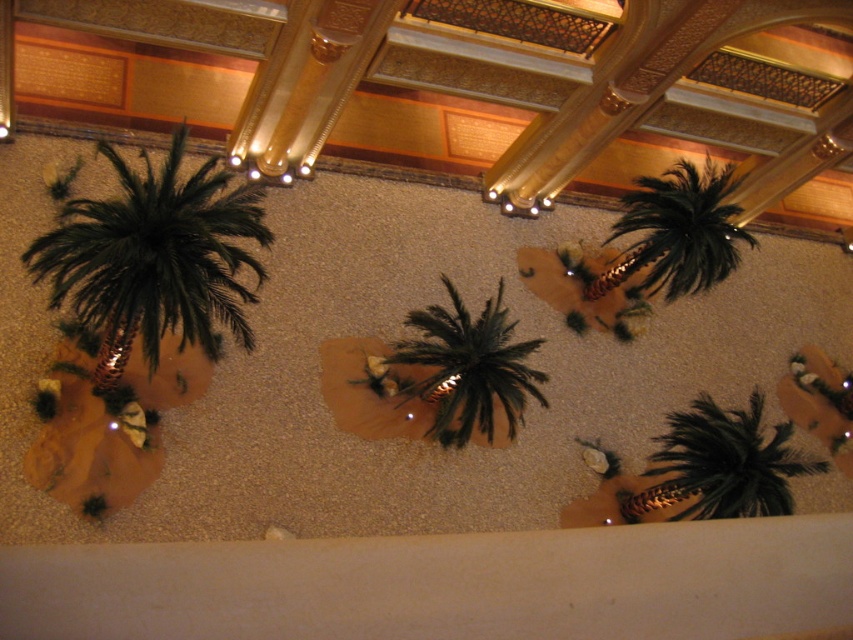
Can you confirm if green artificial palm tree at left is bigger than black feathered palm tree at upper right?

Yes.

Identify the location of green artificial palm tree at left. The width and height of the screenshot is (853, 640). (154, 259).

Between point (189, 202) and point (653, 192), which one is positioned in front?

Positioned in front is point (189, 202).

Where is `green artificial palm tree at left`? Image resolution: width=853 pixels, height=640 pixels. green artificial palm tree at left is located at coordinates (154, 259).

Which is below, green matte palm tree at center or black feathered palm tree at upper right?

green matte palm tree at center is below.

Looking at this image, who is positioned more to the right, green matte palm tree at center or black feathered palm tree at upper right?

Positioned to the right is black feathered palm tree at upper right.

Locate an element on the screen. green matte palm tree at center is located at coordinates (469, 368).

Is green artificial palm tree at left bigger than green matte palm tree at lower right?

Yes, green artificial palm tree at left is bigger than green matte palm tree at lower right.

Does green artificial palm tree at left have a greater width compared to green matte palm tree at lower right?

Indeed, green artificial palm tree at left has a greater width compared to green matte palm tree at lower right.

Identify the location of green artificial palm tree at left. This screenshot has height=640, width=853. (154, 259).

You are a GUI agent. You are given a task and a screenshot of the screen. Output one action in this format:
    pyautogui.click(x=<x>, y=<y>)
    Task: Click on the green artificial palm tree at left
    The image size is (853, 640).
    Given the screenshot: What is the action you would take?
    pyautogui.click(x=154, y=259)